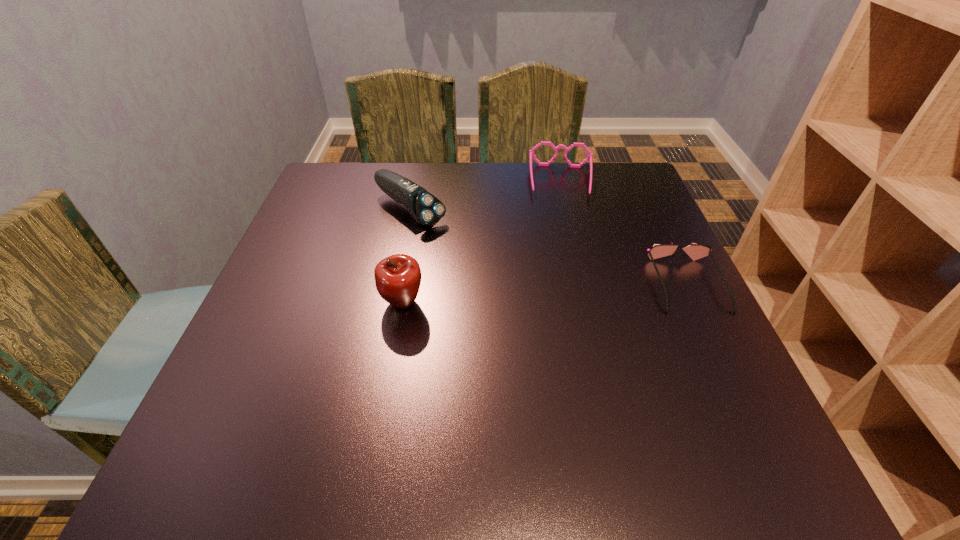
At what (x,y) coordinates should I click in order to perform the action: click on vacant area that lies between the tallest object and the second object from right to left. Please return your answer as a coordinate pair (x, y). This screenshot has width=960, height=540. Looking at the image, I should click on (x=482, y=242).

Where is `free spot between the shortest object and the tallest object`? free spot between the shortest object and the tallest object is located at coordinates (544, 294).

Identify the location of vacant space in between the electric shaver and the third tallest object. The height and width of the screenshot is (540, 960). (486, 195).

The image size is (960, 540). I want to click on the closest object to the electric shaver, so click(x=398, y=277).

Identify the location of object identified as the second closest to the sunglasses. (426, 209).